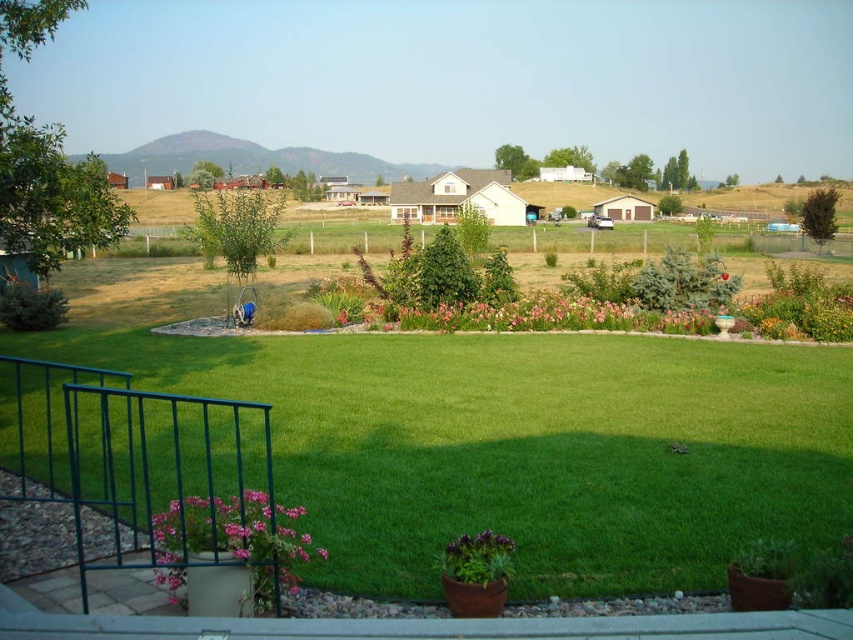
You are a gardener who wants to plant a new flower that requires at least 12 inches of space to grow properly. You have two options in the scene, the pink matte flowers at center and the purple matte flower at center. Which flower do you think would need more vertical space for planting?

The pink matte flowers at center has a greater height compared to the purple matte flower at center, so it would require more vertical space for planting.

In the scene shown: You are designing a garden layout and need to place a new statue that requires a space larger than the green metal railing at lower left. Based on the scene, is there enough space near the pink matte flowers at center for the statue?

The green metal railing at lower left is larger than the pink matte flowers at center, so the space near the pink matte flowers at center may not be sufficient for the statue which requires a space larger than the railing.

You are standing on the balcony looking at the suburban landscape. You see the pink matte flowers at center and the purple matte flower at center. Which one is placed higher in the scene?

The pink matte flowers at center is positioned over the purple matte flower at center, so it is placed higher in the scene.